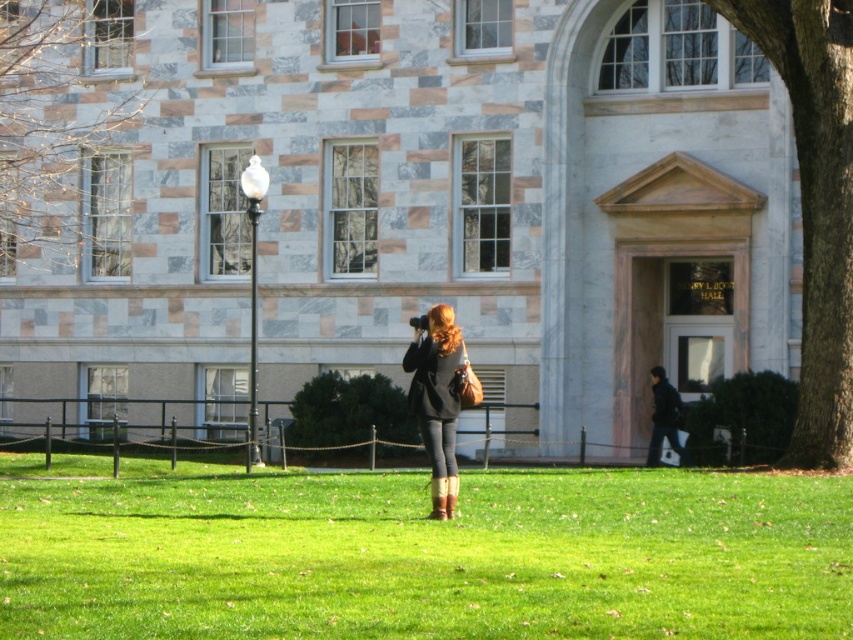
Does point (816, 221) lie behind point (38, 67)?

No, (816, 221) is closer to viewer.

Which is below, smooth brown bark at right or bare branches at upper left?

smooth brown bark at right

Which is in front, point (846, 8) or point (45, 157)?

Point (846, 8) is in front.

Identify the location of smooth brown bark at right. (816, 205).

Does green grass at center appear under bare branches at upper left?

Indeed, green grass at center is positioned under bare branches at upper left.

From the picture: Is green grass at center taller than bare branches at upper left?

No.

Who is more distant from viewer, (45, 589) or (103, 40)?

The point (103, 40) is behind.

Where is `green grass at center`? The image size is (853, 640). green grass at center is located at coordinates (427, 556).

Is smooth brown bark at right shorter than matte black jacket at center?

Yes, smooth brown bark at right is shorter than matte black jacket at center.

Who is positioned more to the right, smooth brown bark at right or matte black jacket at center?

smooth brown bark at right

At what (x,y) coordinates should I click in order to perform the action: click on smooth brown bark at right. Please return your answer as a coordinate pair (x, y). The width and height of the screenshot is (853, 640). Looking at the image, I should click on (816, 205).